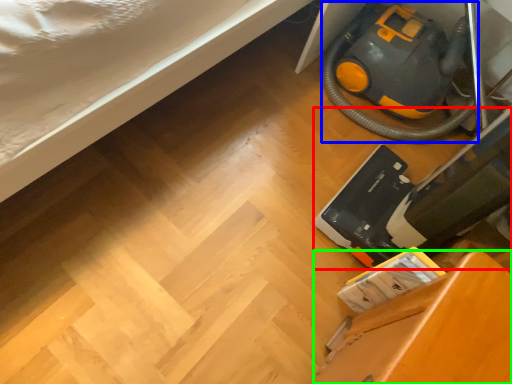
Question: Which object is positioned farthest from equipment (highlighted by a red box)? Select from equipment (highlighted by a blue box) and furniture (highlighted by a green box).

Choices:
 (A) equipment
 (B) furniture

Answer: (A)